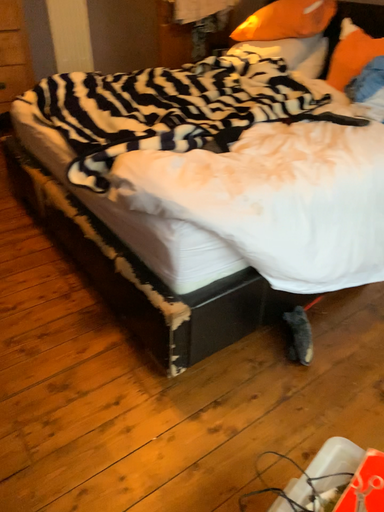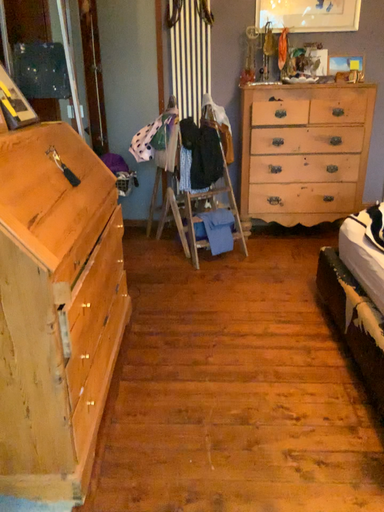
Question: Which way did the camera rotate in the video?

Choices:
 (A) rotated downward
 (B) rotated upward

Answer: (B)